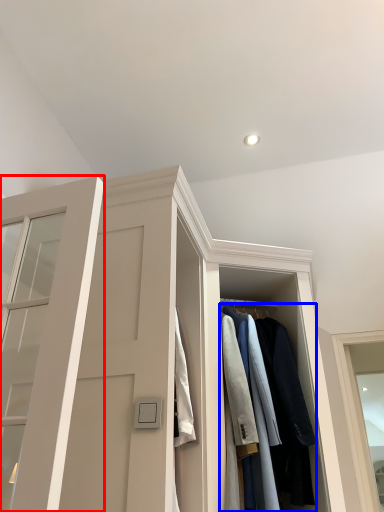
Question: Among these objects, which one is farthest to the camera, door (highlighted by a red box) or clothing (highlighted by a blue box)?

Choices:
 (A) door
 (B) clothing

Answer: (B)